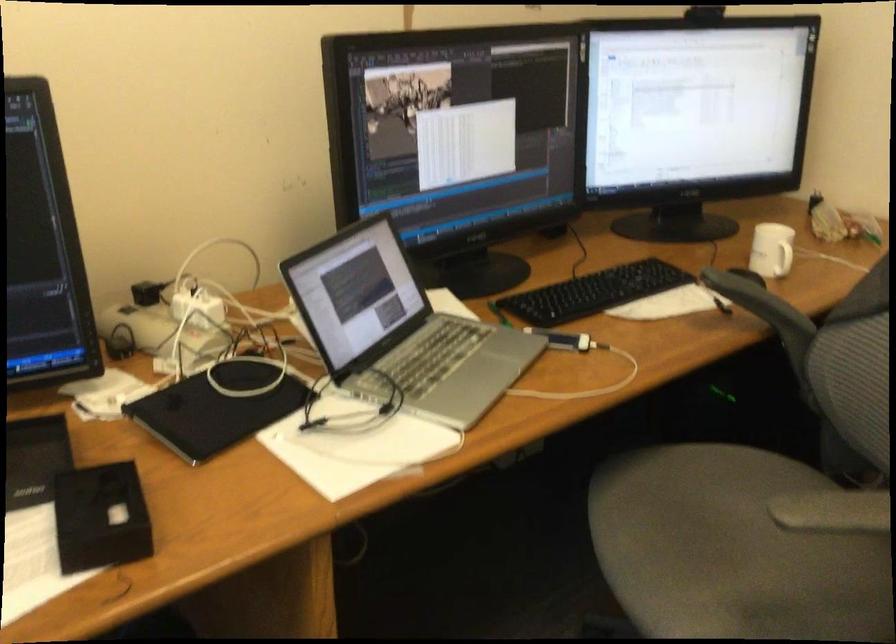
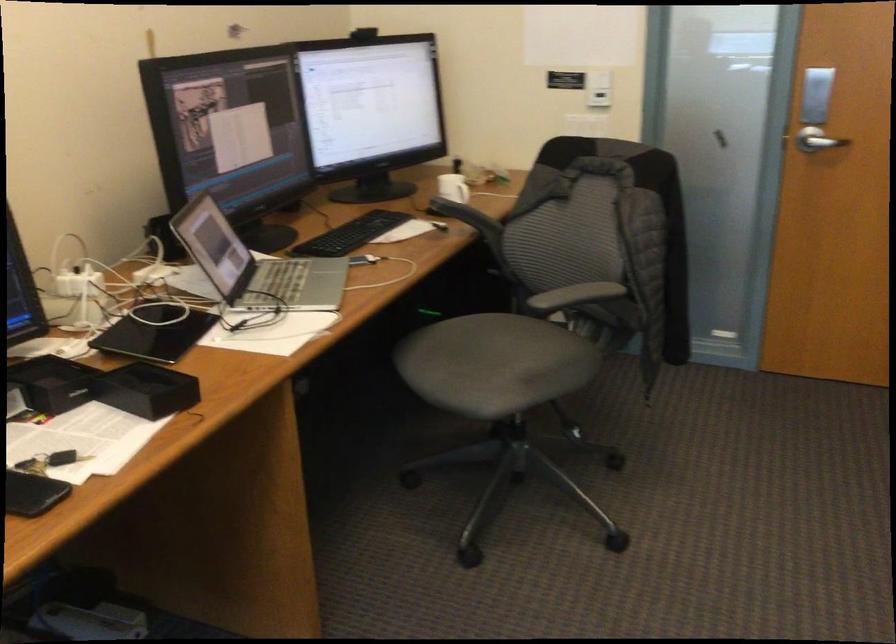
Which direction would the cameraman need to move to produce the second image?

The cameraman moved toward left, backward.